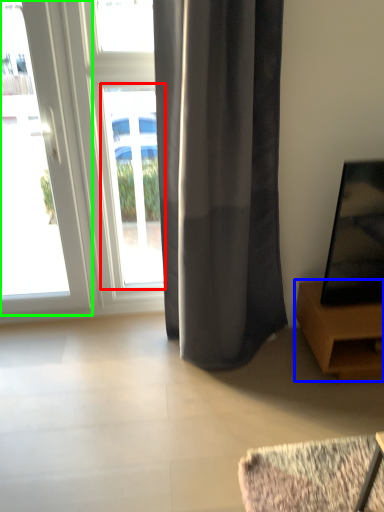
Question: Which object is positioned closest to window (highlighted by a red box)? Select from furniture (highlighted by a blue box) and door (highlighted by a green box).

Choices:
 (A) furniture
 (B) door

Answer: (B)